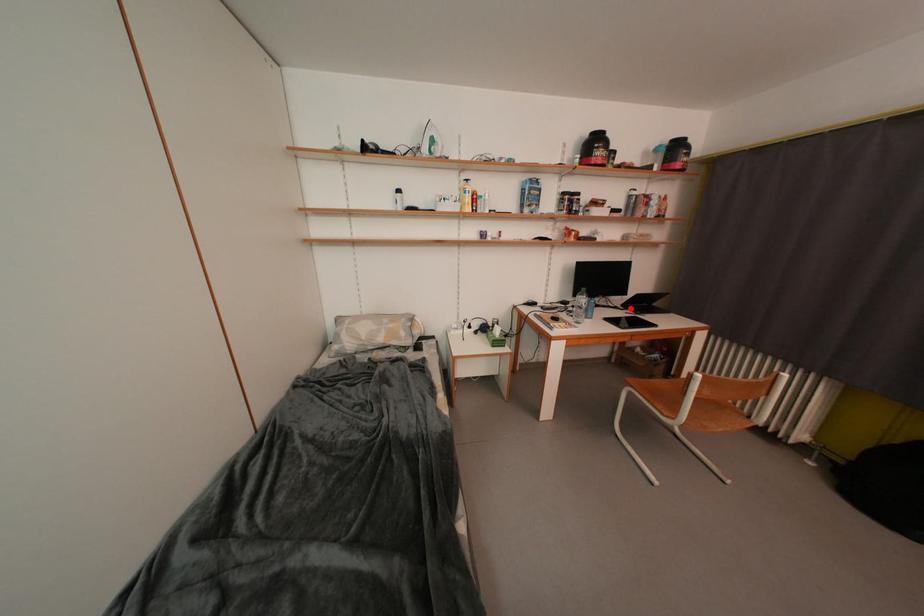
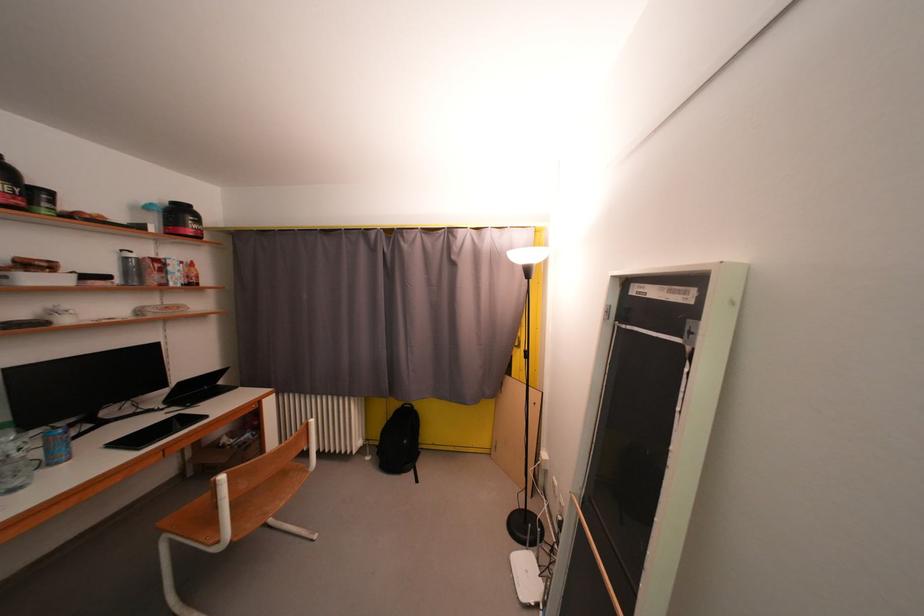
Locate, in the second image, the point that corresponds to the highlighted location in the first image.

(174, 405)